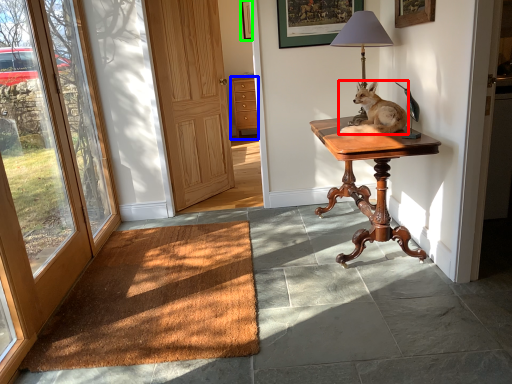
Question: Which object is the closest to the dog (highlighted by a red box)? Choose among these: cabinetry (highlighted by a blue box) or picture frame (highlighted by a green box).

Choices:
 (A) cabinetry
 (B) picture frame

Answer: (B)